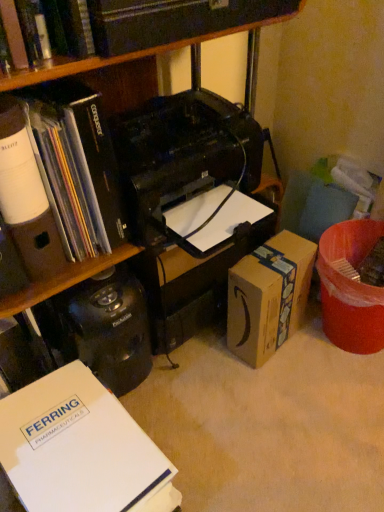
Question: Does white paper at lower left, arranged as the 3th book when viewed from the top, come behind brown cardboard box at lower right?

Choices:
 (A) yes
 (B) no

Answer: (B)

Question: From the image's perspective, is white paper at lower left, arranged as the 3th book when viewed from the top, on brown cardboard box at lower right?

Choices:
 (A) no
 (B) yes

Answer: (A)

Question: Is white paper at lower left, arranged as the 3th book when viewed from the top, wider than brown cardboard box at lower right?

Choices:
 (A) no
 (B) yes

Answer: (B)

Question: From a real-world perspective, does white paper at lower left, the 1th book positioned from the bottom, stand above brown cardboard box at lower right?

Choices:
 (A) yes
 (B) no

Answer: (B)

Question: Is brown cardboard box at lower right surrounded by white paper at lower left, the 1th book positioned from the bottom?

Choices:
 (A) yes
 (B) no

Answer: (B)

Question: Choose the correct answer: Is hardcover book at upper center, which is counted as the 3th book, starting from the bottom, inside white paper at lower left, arranged as the 3th book when viewed from the top, or outside it?

Choices:
 (A) inside
 (B) outside

Answer: (B)

Question: From a real-world perspective, is hardcover book at upper center, which is counted as the 3th book, starting from the bottom, above or below white paper at lower left, arranged as the 3th book when viewed from the top?

Choices:
 (A) above
 (B) below

Answer: (A)

Question: Considering the positions of point (8, 0) and point (38, 499), is point (8, 0) closer or farther from the camera than point (38, 499)?

Choices:
 (A) farther
 (B) closer

Answer: (B)

Question: In terms of size, does hardcover book at upper center, the 1th book viewed from the top, appear bigger or smaller than white paper at lower left, arranged as the 3th book when viewed from the top?

Choices:
 (A) big
 (B) small

Answer: (B)

Question: From their relative heights in the image, would you say brown cardboard box at lower right is taller or shorter than matte black book at left, acting as the second book starting from the bottom?

Choices:
 (A) short
 (B) tall

Answer: (A)

Question: Does point (228, 274) appear closer or farther from the camera than point (67, 218)?

Choices:
 (A) closer
 (B) farther

Answer: (B)

Question: From a real-world perspective, is brown cardboard box at lower right positioned above or below matte black book at left, acting as the second book starting from the bottom?

Choices:
 (A) below
 (B) above

Answer: (A)

Question: From the image's perspective, is brown cardboard box at lower right above or below matte black book at left, acting as the second book starting from the bottom?

Choices:
 (A) below
 (B) above

Answer: (A)

Question: Is matte black book at left, arranged as the 2th book when viewed from the top, bigger or smaller than hardcover book at upper center, the 1th book viewed from the top?

Choices:
 (A) small
 (B) big

Answer: (B)

Question: From a real-world perspective, is matte black book at left, acting as the second book starting from the bottom, physically located above or below hardcover book at upper center, which is counted as the 3th book, starting from the bottom?

Choices:
 (A) above
 (B) below

Answer: (B)